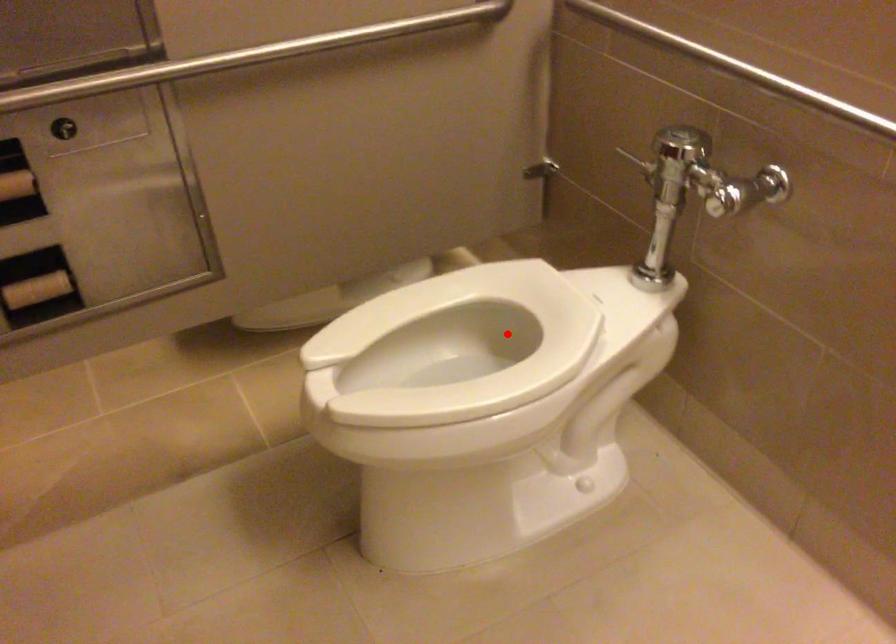
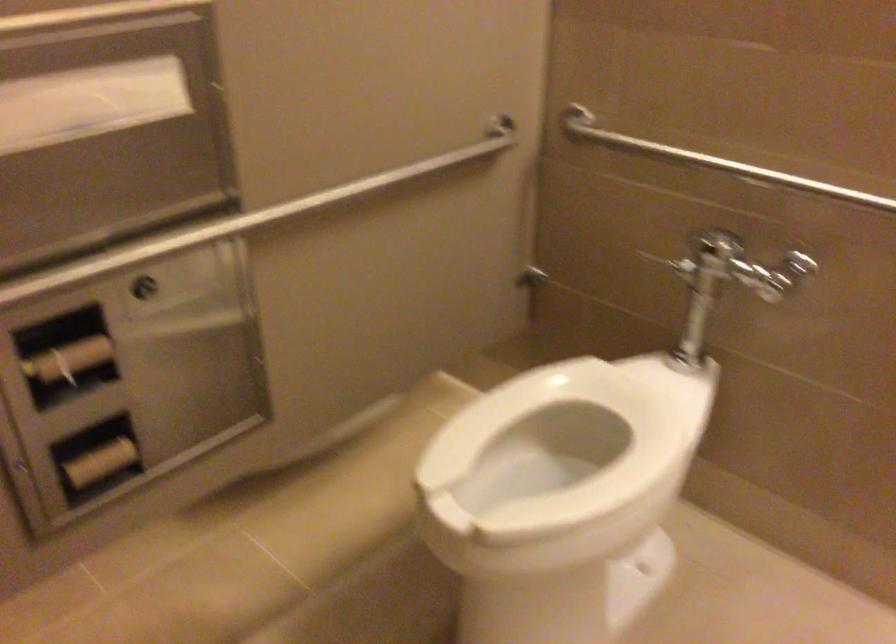
In the second image, find the point that corresponds to the highlighted location in the first image.

(563, 431)